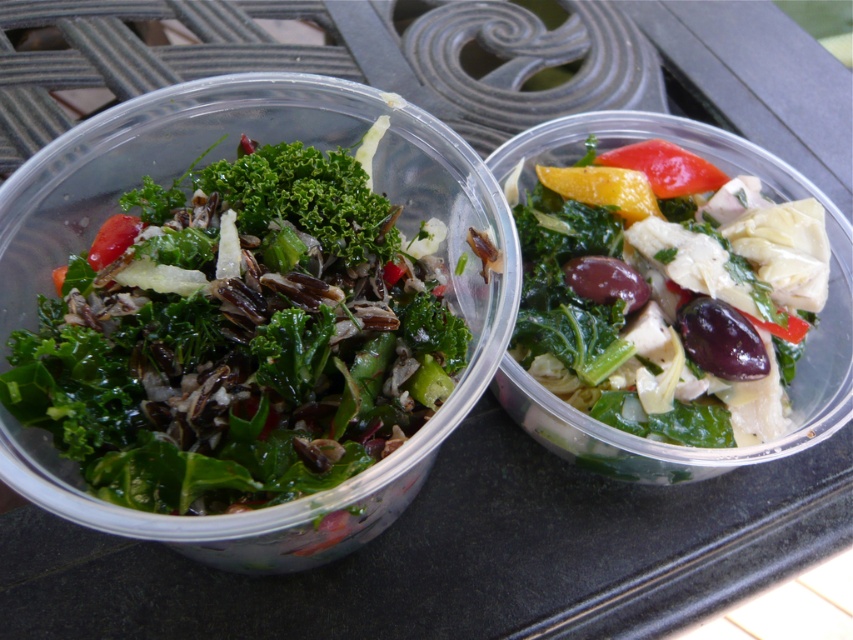
You are a food delivery person who needs to place a yellow matte bell pepper at upper right into a green leafy salad at center. The container holding the salad is 6 inches wide. Can you fit the bell pepper into the salad container without spilling?

The distance between the green leafy salad at center and the yellow matte bell pepper at upper right is 6.27 inches. Since the container is only 6 inches wide, the bell pepper is slightly too far away to fit into the salad container without causing spillage.

You are a food critic observing two salads. The green leafy salad at center and the yellow matte bell pepper at upper right are both visible. Which salad has a greater height?

The green leafy salad at center is taller than the yellow matte bell pepper at upper right, so the green leafy salad at center has a greater height.